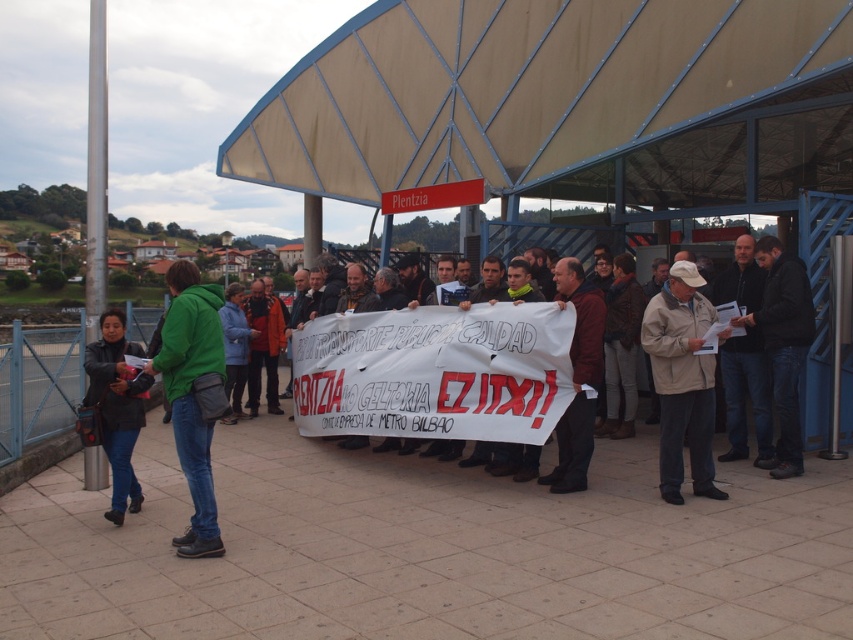
You are a photographer trying to capture a clear photo of the green fabric jacket at center and dark blue jeans at center. Since the jacket is bigger than the jeans, which object should you focus on to ensure both are in frame without cropping?

The green fabric jacket at center is bigger than the dark blue jeans at center, so focusing on the green fabric jacket at center will ensure both are in frame without cropping.

You are a photographer trying to capture a clear shot of the beige fabric jacket at center and the green matte jacket at left. Since the jackets are close to each other, you need to adjust your camera settings to ensure both are in focus. Which jacket has a thicker material that might require more careful focus adjustment?

The green matte jacket at left has a thicker material than the beige fabric jacket at center, so it might require more careful focus adjustment.